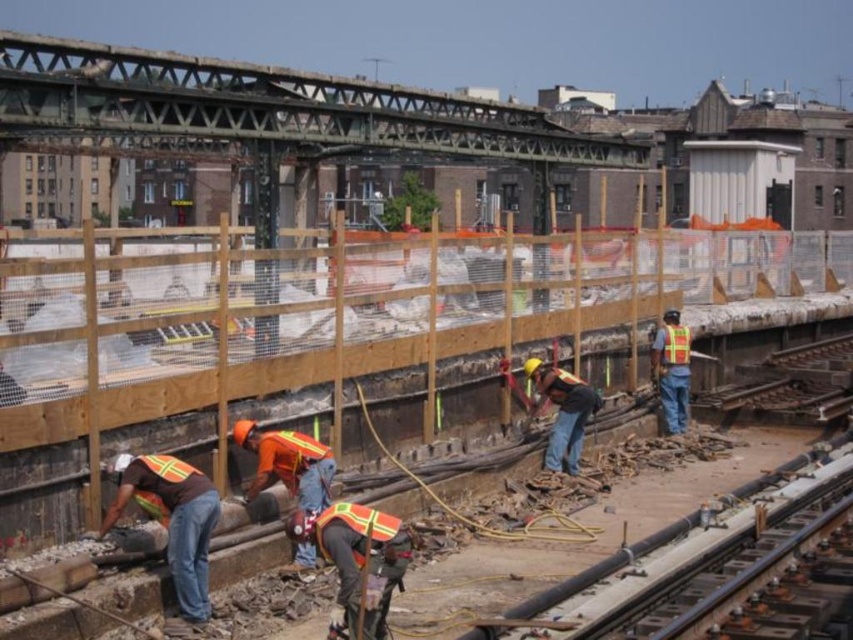
You are a safety inspector at the construction site. You notice two workers wearing different colored reflective vests. The brown reflective vest at lower left and the reflective orange vest at center. Which worker is shorter in height?

The brown reflective vest at lower left is not as tall as the reflective orange vest at center, so the worker wearing the brown reflective vest at lower left is shorter in height.

You are a safety inspector standing at the back of the construction site. You notice two workers wearing reflective orange vest at center and reflective yellow safety vest at center. Which worker is nearer to you?

The reflective orange vest at center is closer to the viewer than the reflective yellow safety vest at center, so the worker wearing the reflective orange vest at center is nearer to you.